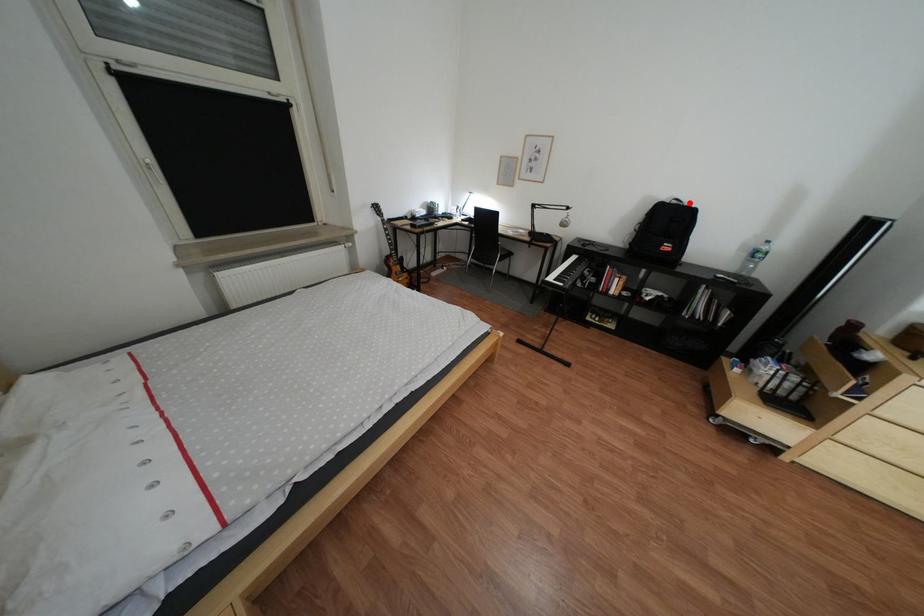
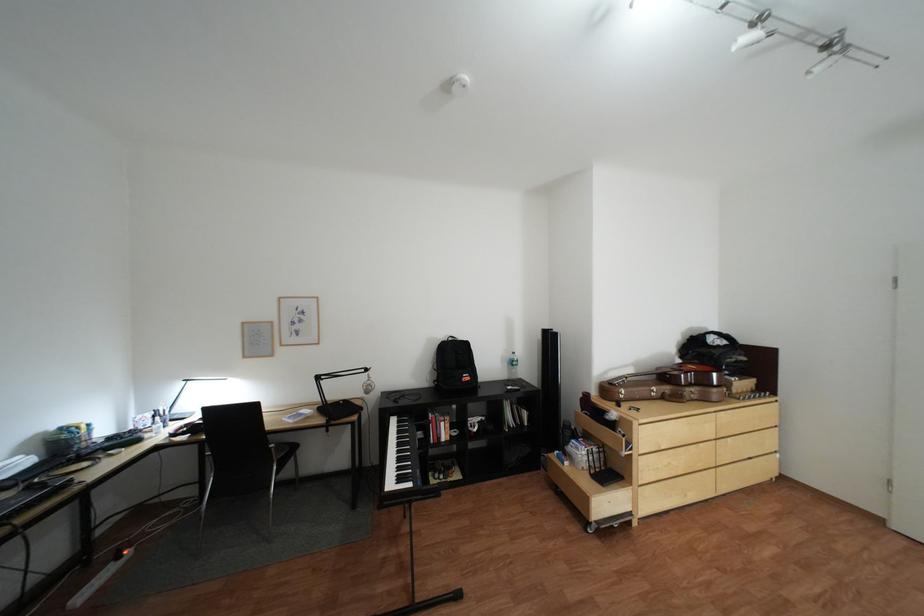
Question: I am providing you with two images of the same scene from different viewpoints. Given a red point in image1, look at the same physical point in image2. Is it:

Choices:
 (A) Closer to the viewpoint
 (B) Farther from the viewpoint

Answer: (B)